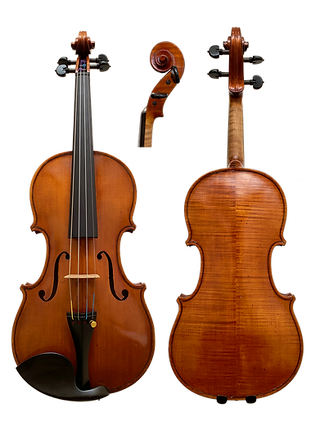
Find the location of `knob`. knob is located at coordinates (174, 77).